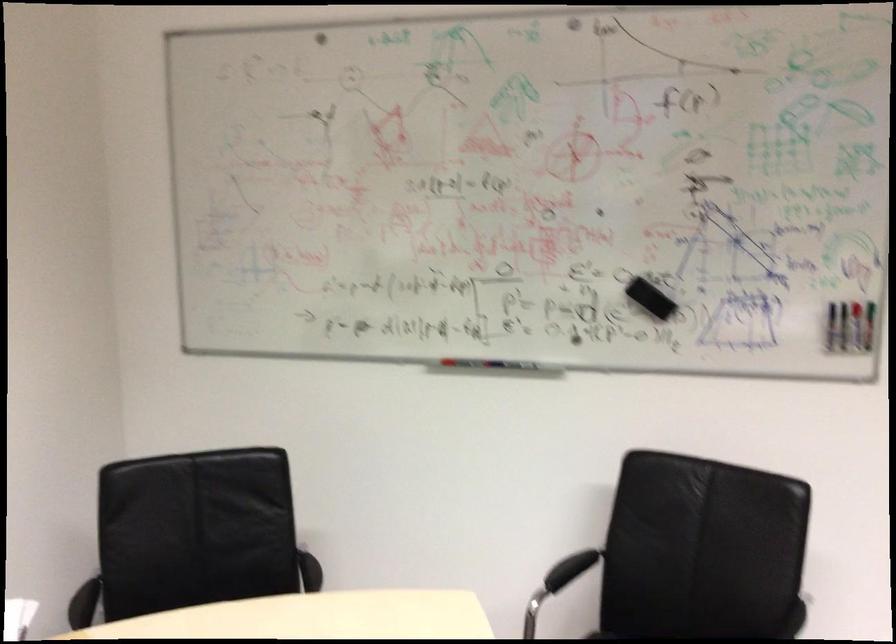
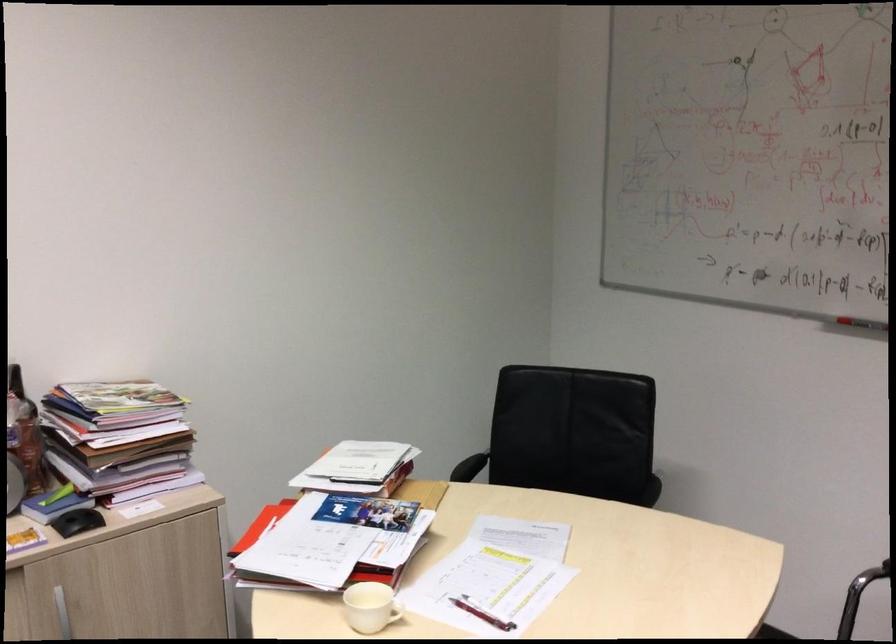
Locate, in the second image, the point that corresponds to the point at 460,366 in the first image.

(860, 327)